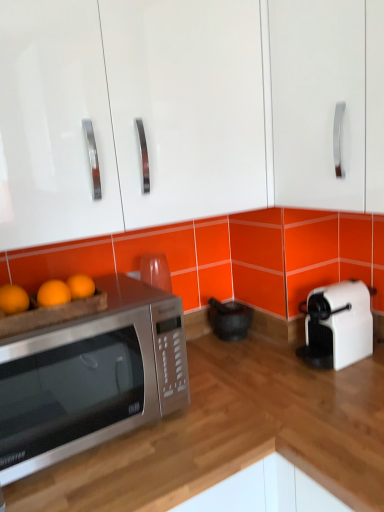
Question: From the image's perspective, is black matte mortar and pestle at center located beneath satin silver microwave at left?

Choices:
 (A) no
 (B) yes

Answer: (A)

Question: Is black matte mortar and pestle at center behind satin silver microwave at left?

Choices:
 (A) yes
 (B) no

Answer: (A)

Question: Is there a large distance between black matte mortar and pestle at center and satin silver microwave at left?

Choices:
 (A) yes
 (B) no

Answer: (B)

Question: Can you confirm if black matte mortar and pestle at center is smaller than satin silver microwave at left?

Choices:
 (A) yes
 (B) no

Answer: (A)

Question: From a real-world perspective, is black matte mortar and pestle at center located beneath satin silver microwave at left?

Choices:
 (A) no
 (B) yes

Answer: (B)

Question: Considering the relative positions of black matte mortar and pestle at center and satin silver microwave at left in the image provided, is black matte mortar and pestle at center in front of satin silver microwave at left?

Choices:
 (A) yes
 (B) no

Answer: (B)

Question: Is glossy white cabinet at upper center, placed as the 1th cabinetry when sorted from left to right, in contact with white plastic toaster at right?

Choices:
 (A) no
 (B) yes

Answer: (A)

Question: From the image's perspective, is glossy white cabinet at upper center, positioned as the second cabinetry in right-to-left order, on white plastic toaster at right?

Choices:
 (A) no
 (B) yes

Answer: (B)

Question: From the image's perspective, is glossy white cabinet at upper center, positioned as the second cabinetry in right-to-left order, beneath white plastic toaster at right?

Choices:
 (A) no
 (B) yes

Answer: (A)

Question: Is glossy white cabinet at upper center, placed as the 1th cabinetry when sorted from left to right, shorter than white plastic toaster at right?

Choices:
 (A) no
 (B) yes

Answer: (A)

Question: Can you confirm if glossy white cabinet at upper center, positioned as the second cabinetry in right-to-left order, is positioned to the left of white plastic toaster at right?

Choices:
 (A) no
 (B) yes

Answer: (B)

Question: From a real-world perspective, is glossy white cabinet at upper center, positioned as the second cabinetry in right-to-left order, on top of white plastic toaster at right?

Choices:
 (A) yes
 (B) no

Answer: (A)

Question: Is white plastic toaster at right positioned beyond the bounds of glossy white cabinet at upper center, positioned as the second cabinetry in right-to-left order?

Choices:
 (A) yes
 (B) no

Answer: (A)